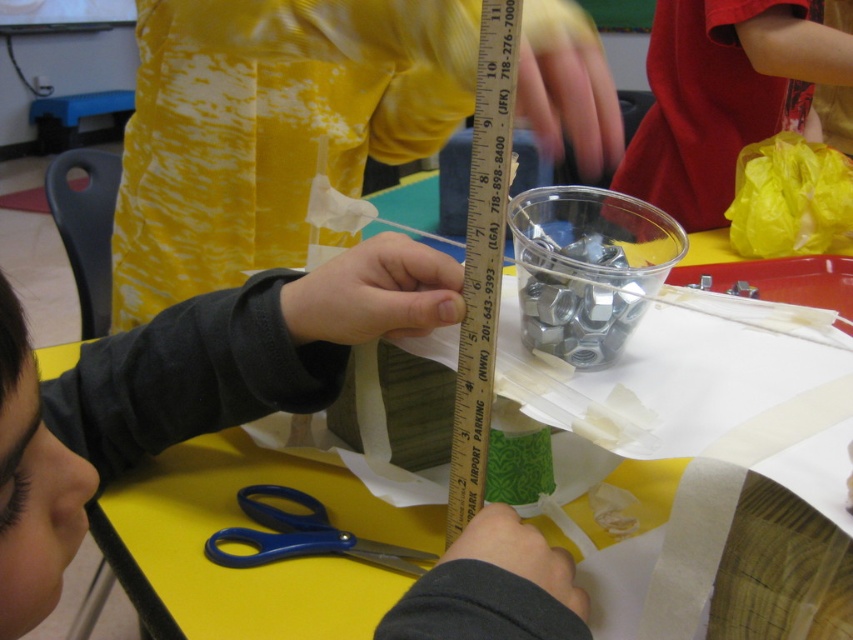
Does wooden ruler at center come in front of blue plastic scissors at lower center?

Yes.

Between wooden ruler at center and blue plastic scissors at lower center, which one has less height?

With less height is blue plastic scissors at lower center.

Does point (491, 388) come behind point (238, 534)?

No, (491, 388) is closer to viewer.

Find the location of a particular element. wooden ruler at center is located at coordinates (482, 259).

Does yellow paper at center come in front of blue plastic scissors at lower center?

Yes, yellow paper at center is closer to the viewer.

From the picture: Does yellow paper at center have a smaller size compared to blue plastic scissors at lower center?

Actually, yellow paper at center might be larger than blue plastic scissors at lower center.

Is point (341, 493) more distant than point (418, 561)?

Yes, it is behind point (418, 561).

Locate an element on the screen. yellow paper at center is located at coordinates (245, 524).

Who is positioned more to the left, yellow paper at center or wooden ruler at center?

From the viewer's perspective, yellow paper at center appears more on the left side.

Is yellow paper at center taller than wooden ruler at center?

No.

Is point (840, 500) more distant than point (468, 224)?

No, (840, 500) is in front of (468, 224).

What are the coordinates of `yellow paper at center` in the screenshot? It's located at (245, 524).